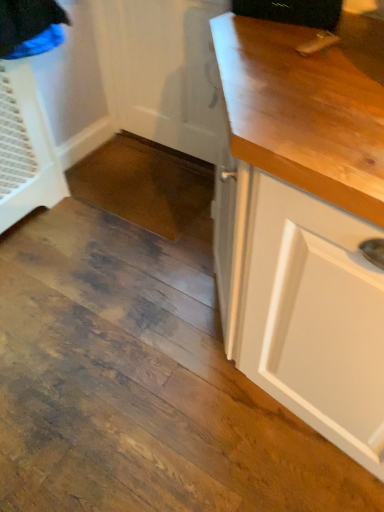
Where is `free space in front of white plastic laundry basket at left`? free space in front of white plastic laundry basket at left is located at coordinates (43, 260).